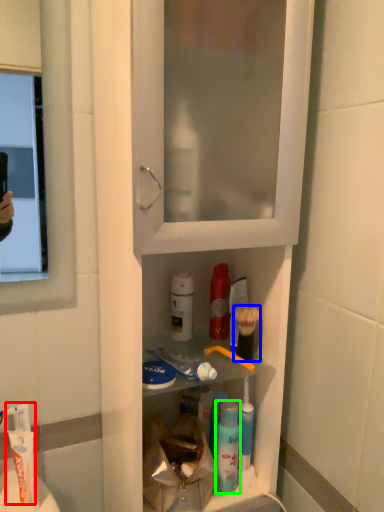
Question: Estimate the real-world distances between objects in this image. Which object is farther from toothpaste (highlighted by a red box), brush (highlighted by a blue box) or mouthwash (highlighted by a green box)?

Choices:
 (A) brush
 (B) mouthwash

Answer: (A)